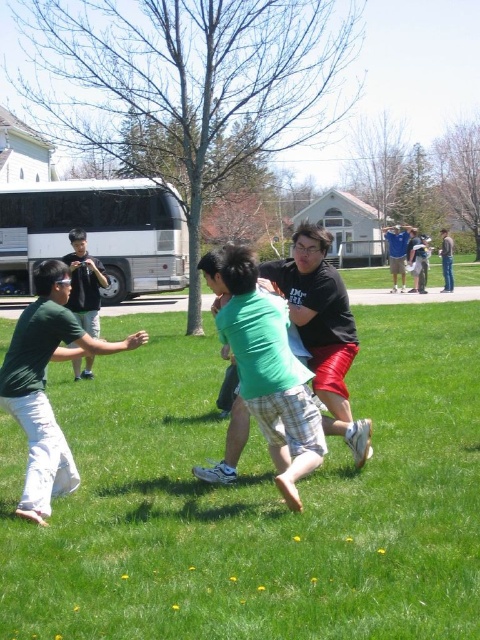
Question: Which object is positioned farthest from the green cotton shirt at center?

Choices:
 (A) denim jeans at right
 (B) white matte tour bus at left
 (C) blue fabric shirt at center

Answer: (C)

Question: Can you confirm if white matte tour bus at left is thinner than green cotton shirt at center?

Choices:
 (A) yes
 (B) no

Answer: (A)

Question: Does blue fabric shirt at center have a lesser width compared to denim jeans at right?

Choices:
 (A) no
 (B) yes

Answer: (B)

Question: Considering the real-world distances, which object is closest to the white matte tour bus at left?

Choices:
 (A) blue fabric shirt at center
 (B) green cotton shirt at center

Answer: (A)

Question: Is green grass at center above white matte tour bus at left?

Choices:
 (A) no
 (B) yes

Answer: (A)

Question: Among these objects, which one is farthest from the camera?

Choices:
 (A) green grass at center
 (B) white matte tour bus at left
 (C) green cotton shirt at center
 (D) denim jeans at right

Answer: (D)